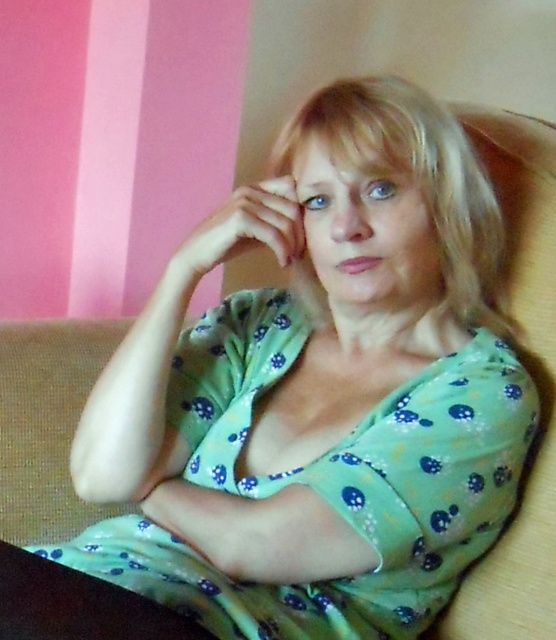
You are an artist trying to sketch the scene. You notice the green dotted fabric dress at center and the matte green hand at center. Which object should you draw first to ensure proper layering?

The green dotted fabric dress at center should be drawn first since it is in front of the matte green hand at center, ensuring the hand appears behind the dress in the final sketch.

You are an artist sketching the scene and want to ensure the positioning of the blonde smooth hair at center and the matte green hand at center is accurate. Which object is located to the right of the other?

The blonde smooth hair at center is to the right of the matte green hand at center.

Consider the image. You are an interior designer planning to place a decorative item at point (330, 481). The scene has a person wearing a green dotted fabric dress at center. Will the decorative item be placed on the person?

The green dotted fabric dress at center is located at point (330, 481), so placing the decorative item at that point would place it on the person wearing the green dotted fabric dress at center.